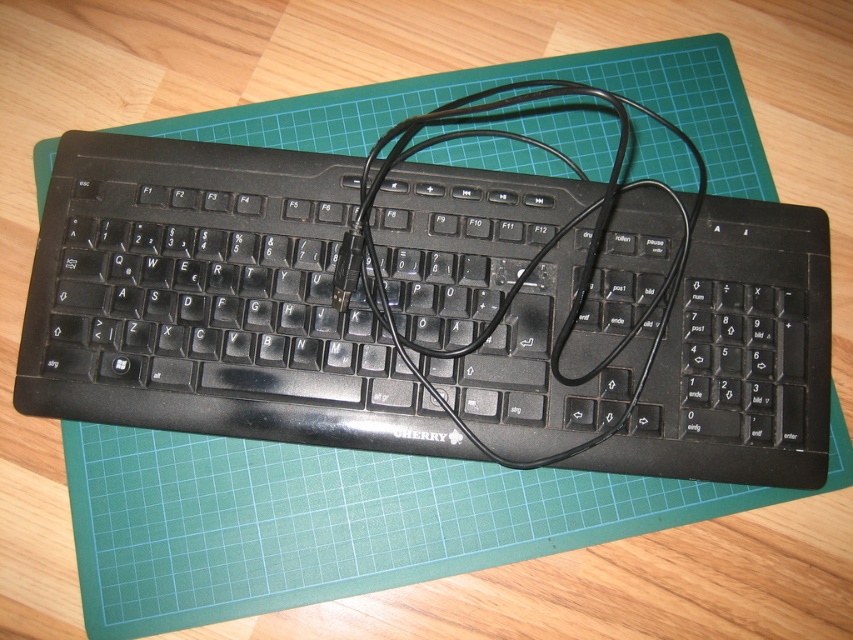
Question: Which object is closer to the camera taking this photo?

Choices:
 (A) black cable at center
 (B) black plastic keyboard at center

Answer: (A)

Question: Does black plastic keyboard at center appear on the left side of black cable at center?

Choices:
 (A) yes
 (B) no

Answer: (A)

Question: Which point is farther to the camera?

Choices:
 (A) (190, 362)
 (B) (531, 140)

Answer: (B)

Question: Can you confirm if black plastic keyboard at center is positioned to the right of black cable at center?

Choices:
 (A) yes
 (B) no

Answer: (B)

Question: Observing the image, what is the correct spatial positioning of black plastic keyboard at center in reference to black cable at center?

Choices:
 (A) above
 (B) below

Answer: (B)